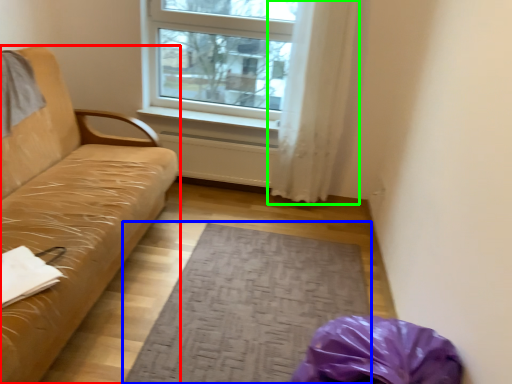
Question: Which is farther away from studio couch (highlighted by a red box)? mat (highlighted by a blue box) or curtain (highlighted by a green box)?

Choices:
 (A) mat
 (B) curtain

Answer: (B)